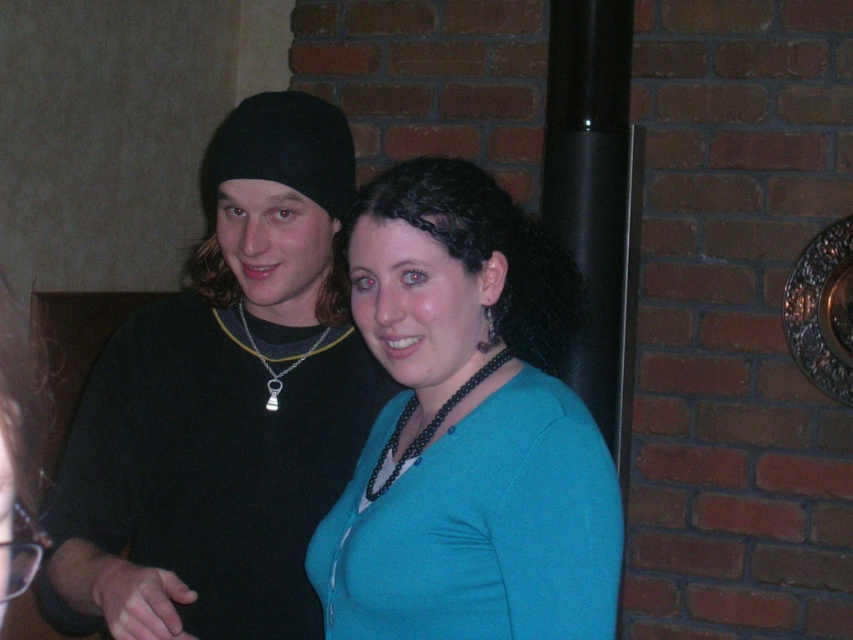
Between point (461, 176) and point (276, 381), which one is positioned behind?

The point (276, 381) is behind.

Between point (419, 193) and point (294, 368), which one is positioned in front?

Positioned in front is point (419, 193).

I want to click on teal matte cardigan at center, so click(467, 429).

Does teal matte cardigan at center lie in front of black beaded necklace at center?

That is True.

I want to click on teal matte cardigan at center, so click(467, 429).

Is point (108, 488) closer to camera compared to point (477, 616)?

No, it is behind (477, 616).

Is point (247, 504) positioned behind point (558, 352)?

No, it is in front of (558, 352).

This screenshot has width=853, height=640. Find the location of `black matte beanie at left`. black matte beanie at left is located at coordinates (224, 404).